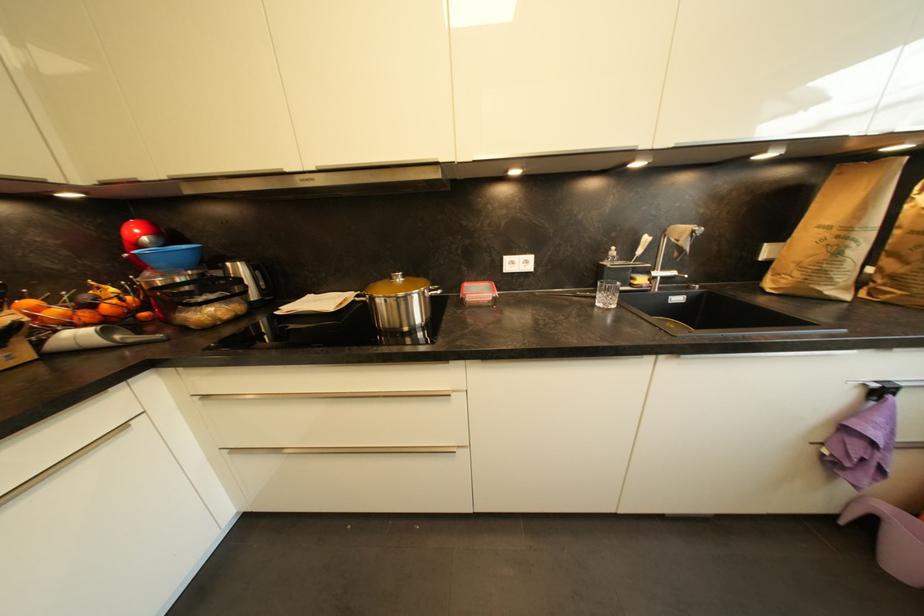
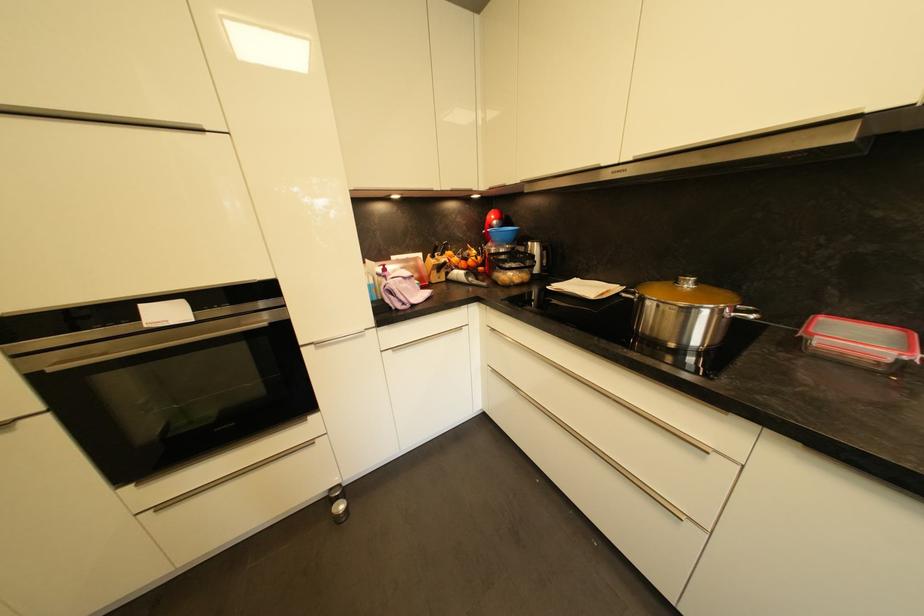
In the second image, find the point that corresponds to pixel 140 268 in the first image.

(492, 240)